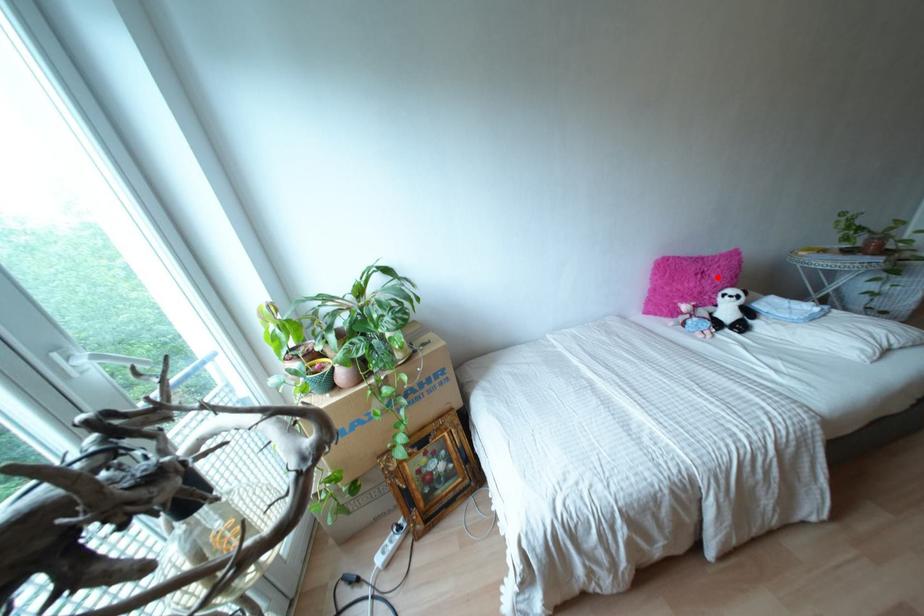
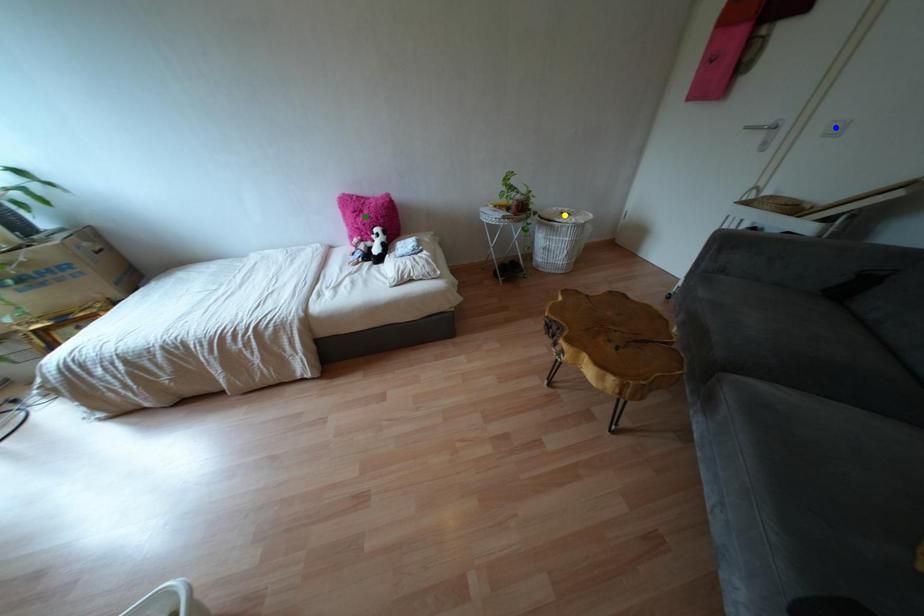
Question: I am providing you with two images of the same scene from different viewpoints. A red point is marked on the first image. You are given multiple points on the second image. Which spot in image 2 lines up with the point in image 1?

Choices:
 (A) green point
 (B) blue point
 (C) yellow point

Answer: (A)